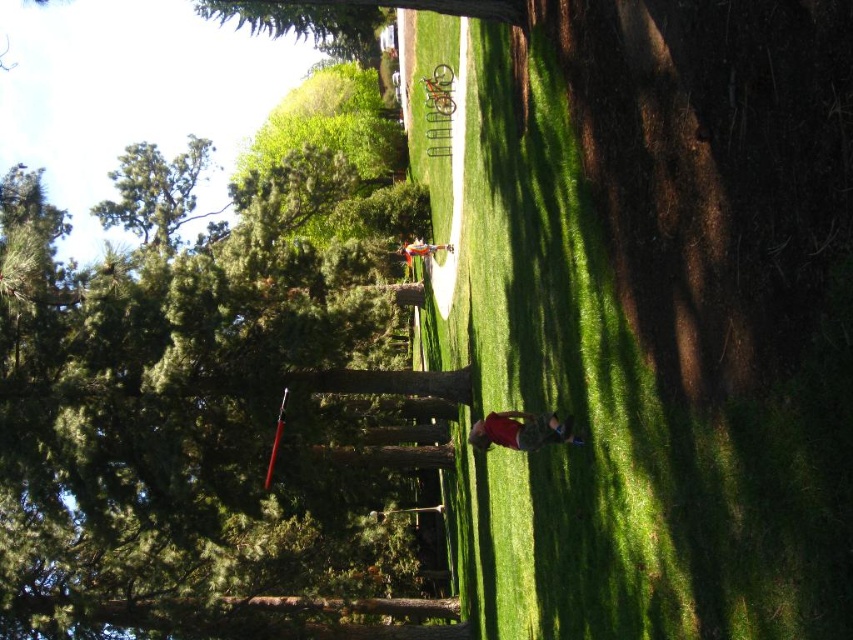
In the scene shown: Who is positioned more to the right, green textured tree at upper left or matte white shirt at center?

matte white shirt at center

Between green textured tree at upper left and matte white shirt at center, which one has more height?

green textured tree at upper left is taller.

Is point (50, 467) positioned before point (418, 244)?

Yes, point (50, 467) is in front of point (418, 244).

What are the coordinates of `green textured tree at upper left` in the screenshot? It's located at [x=196, y=408].

Is green textured tree at upper left smaller than red cotton shirt at lower center?

No.

Does point (157, 264) come in front of point (526, 442)?

That is False.

You are a GUI agent. You are given a task and a screenshot of the screen. Output one action in this format:
    pyautogui.click(x=<x>, y=<y>)
    Task: Click on the green textured tree at upper left
    This screenshot has width=853, height=640.
    Given the screenshot: What is the action you would take?
    pyautogui.click(x=196, y=408)

Describe the element at coordinates (520, 429) in the screenshot. I see `red cotton shirt at lower center` at that location.

Which of these two, red cotton shirt at lower center or matte white shirt at center, stands shorter?

red cotton shirt at lower center is shorter.

Image resolution: width=853 pixels, height=640 pixels. Describe the element at coordinates (520, 429) in the screenshot. I see `red cotton shirt at lower center` at that location.

You are a GUI agent. You are given a task and a screenshot of the screen. Output one action in this format:
    pyautogui.click(x=<x>, y=<y>)
    Task: Click on the red cotton shirt at lower center
    The height and width of the screenshot is (640, 853).
    Given the screenshot: What is the action you would take?
    pyautogui.click(x=520, y=429)